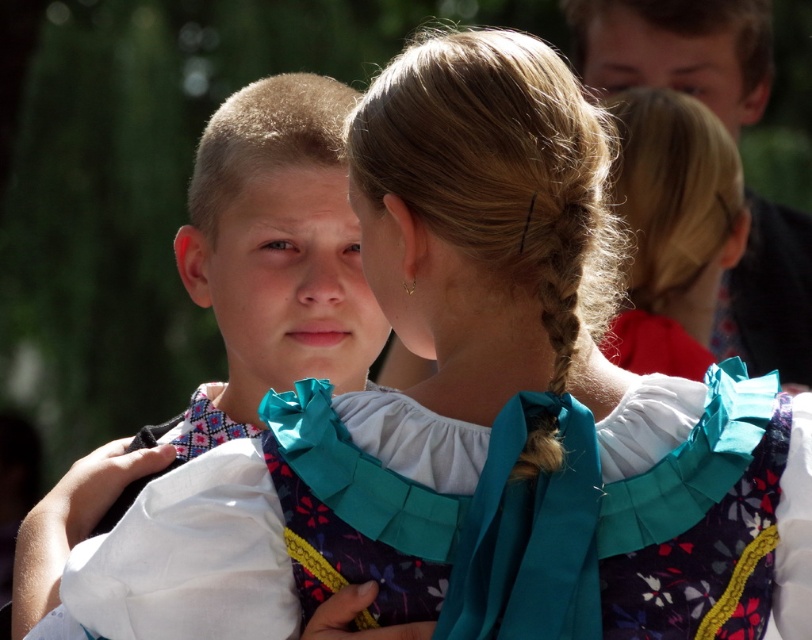
Does floral fabric dress at center have a lesser height compared to teal satin ribbon at center?

Yes.

The width and height of the screenshot is (812, 640). I want to click on floral fabric dress at center, so click(x=184, y=550).

The image size is (812, 640). Describe the element at coordinates (184, 550) in the screenshot. I see `floral fabric dress at center` at that location.

This screenshot has width=812, height=640. Identify the location of floral fabric dress at center. (184, 550).

Does floral fabric dress at center have a lesser height compared to blonde hair at upper center?

Correct, floral fabric dress at center is not as tall as blonde hair at upper center.

Between point (54, 490) and point (668, 371), which one is positioned in front?

Positioned in front is point (54, 490).

Locate an element on the screen. The width and height of the screenshot is (812, 640). floral fabric dress at center is located at coordinates (184, 550).

Is matte white shirt at center bigger than floral fabric dress at center?

Yes.

Who is positioned more to the left, matte white shirt at center or floral fabric dress at center?

matte white shirt at center

Locate an element on the screen. The height and width of the screenshot is (640, 812). matte white shirt at center is located at coordinates (274, 253).

I want to click on matte white shirt at center, so click(x=274, y=253).